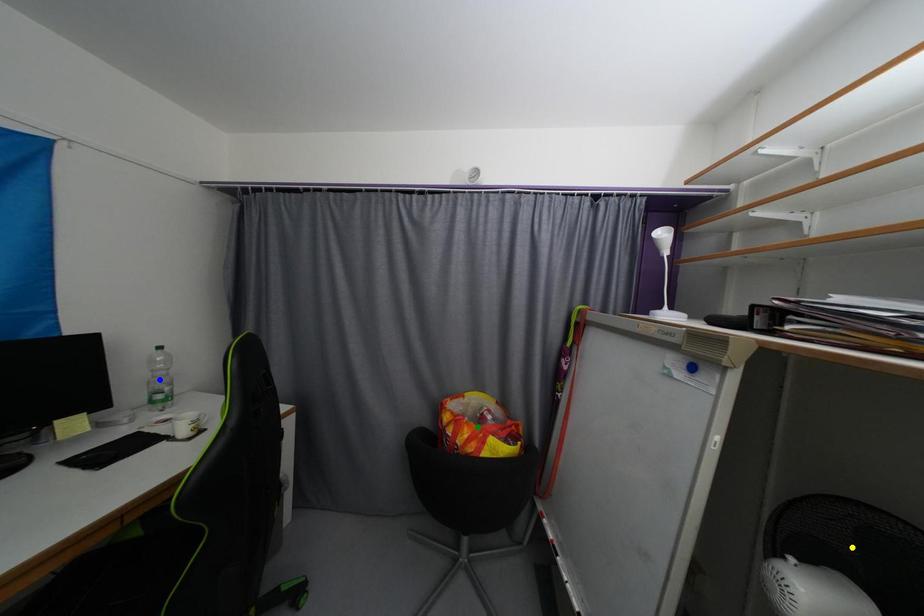
From the picture: Order these from nearest to farthest:
- blue point
- yellow point
- green point

yellow point → blue point → green point